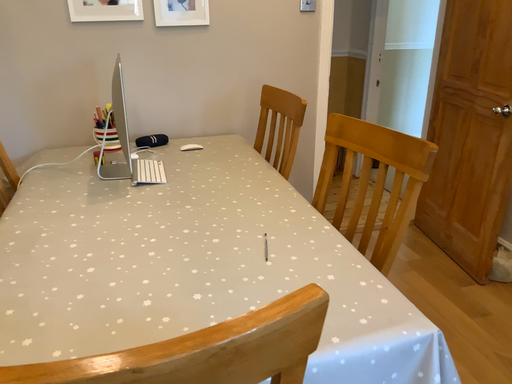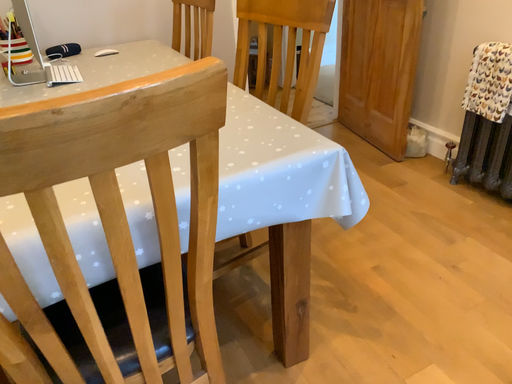
Question: Which way did the camera rotate in the video?

Choices:
 (A) rotated downward
 (B) rotated upward

Answer: (A)